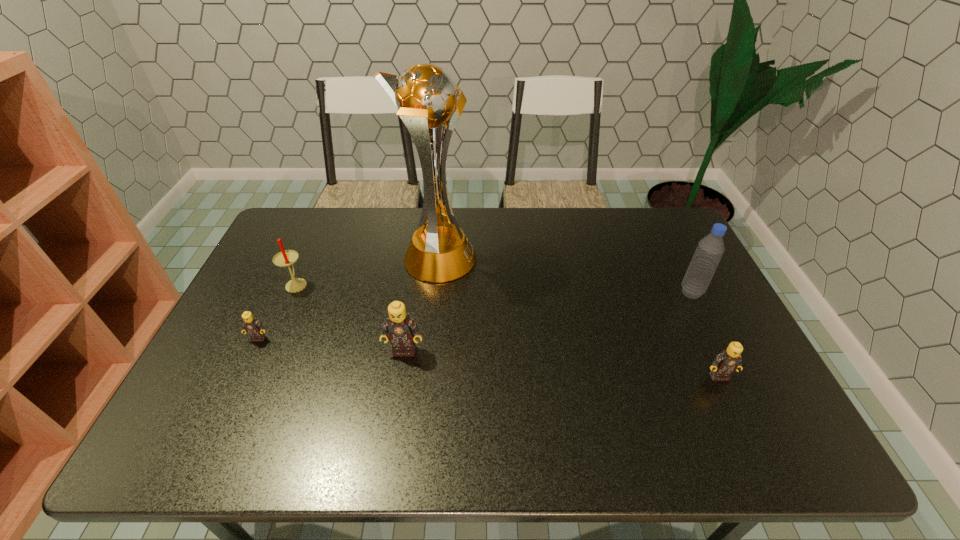
Identify the location of free space that is in between the tallest Lego and the candle. (350, 317).

Where is `empty space between the candle and the second farthest Lego`? empty space between the candle and the second farthest Lego is located at coordinates coord(350,317).

Where is `free spot between the trophy and the second tallest object`? free spot between the trophy and the second tallest object is located at coordinates (564, 276).

The image size is (960, 540). I want to click on empty space between the trophy and the second nearest Lego, so click(x=420, y=305).

Identify the location of free space between the candle and the bottle. This screenshot has width=960, height=540. (494, 288).

The image size is (960, 540). I want to click on blank region between the rightmost Lego and the tallest object, so click(578, 318).

You are a GUI agent. You are given a task and a screenshot of the screen. Output one action in this format:
    pyautogui.click(x=<x>, y=<y>)
    Task: Click on the vacant area that lies between the bottle and the second nearest Lego
    This screenshot has width=960, height=540.
    Given the screenshot: What is the action you would take?
    pyautogui.click(x=548, y=321)

The width and height of the screenshot is (960, 540). Identify the location of object that stands as the fourth closest to the leftmost Lego. (728, 361).

At what (x,y) coordinates should I click in order to perform the action: click on object that ranks as the third closest to the candle. Please return your answer as a coordinate pair (x, y). The image size is (960, 540). Looking at the image, I should click on pyautogui.click(x=401, y=328).

Identify which Lego is the closest to the bottle. Please provide its 2D coordinates. Your answer should be formatted as a tuple, i.e. [(x, y)], where the tuple contains the x and y coordinates of a point satisfying the conditions above.

[(728, 361)]